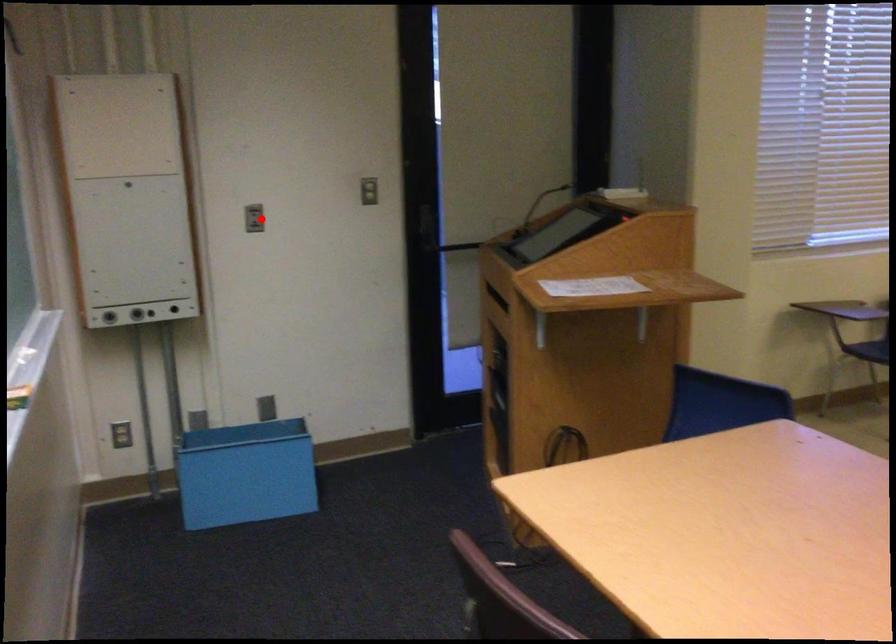
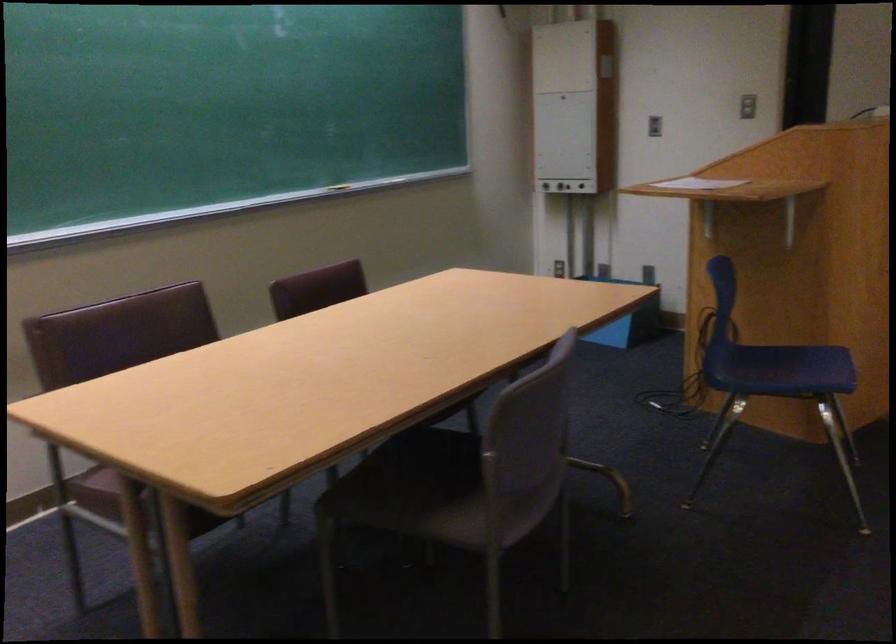
Question: I am providing you with two images of the same scene from different viewpoints. A red point is shown in image1. For the corresponding object point in image2, is it positioned nearer or farther from the camera?

Choices:
 (A) Nearer
 (B) Farther

Answer: (B)